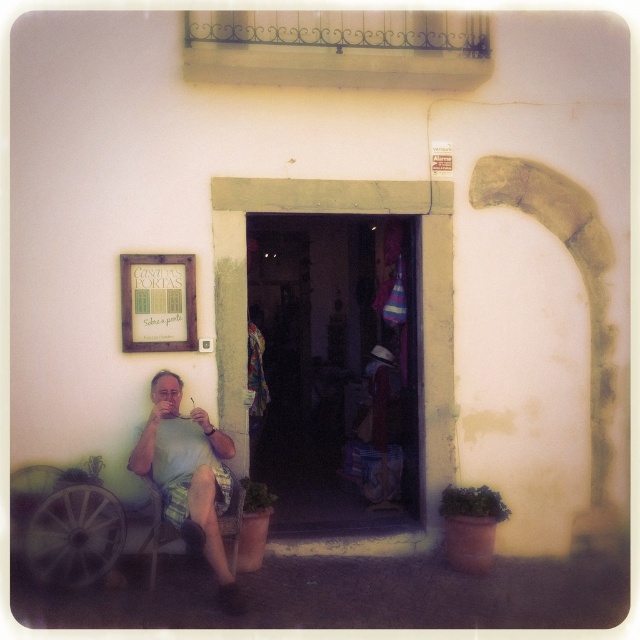
Question: Can you confirm if green matte plant at lower right is positioned below green leafy plant at lower center?

Choices:
 (A) yes
 (B) no

Answer: (A)

Question: Which object appears closest to the camera in this image?

Choices:
 (A) green matte plant at lower right
 (B) green striped shorts at lower left
 (C) green leafy plant at lower left
 (D) white fabric shirt at left

Answer: (D)

Question: Is green striped shorts at lower left below green leafy plant at lower center?

Choices:
 (A) no
 (B) yes

Answer: (A)

Question: Does white fabric shirt at left lie in front of green leafy plant at lower center?

Choices:
 (A) yes
 (B) no

Answer: (A)

Question: Considering the real-world distances, which object is closest to the green matte plant at lower right?

Choices:
 (A) green striped shorts at lower left
 (B) white fabric shirt at left
 (C) green leafy plant at lower center
 (D) green leafy plant at lower left

Answer: (C)

Question: Which point appears farthest from the camera in this image?

Choices:
 (A) (74, 476)
 (B) (170, 513)
 (C) (440, 502)
 (D) (260, 483)

Answer: (D)